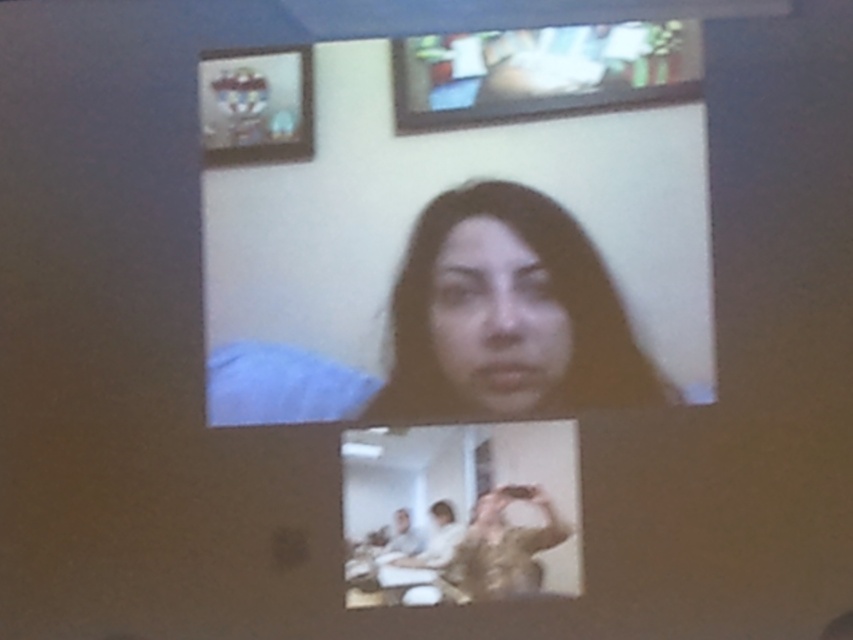
You are a user trying to adjust your video call setup. You notice the matte black screen at center and the smooth skin face at center. Which object is positioned closer to you in the current camera view?

The matte black screen at center is closer to the viewer than the smooth skin face at center, so the matte black screen at center is positioned closer to you in the current camera view.

You are a photographer trying to adjust the lighting for a video call. The subject has dark matte hair at center. You need to ensure that the camera is positioned at least 9 feet away to avoid overexposure. Is the current camera position sufficient?

The dark matte hair at center and camera are 8.98 feet apart from each other. Since 8.98 feet is slightly less than 9 feet, the camera is too close to avoid overexposure. Move it back a bit.

You are a virtual assistant analyzing a video call image. You see the dark matte hair at center and the smooth skin face at center. Which object is taller?

The dark matte hair at center is taller than the smooth skin face at center.